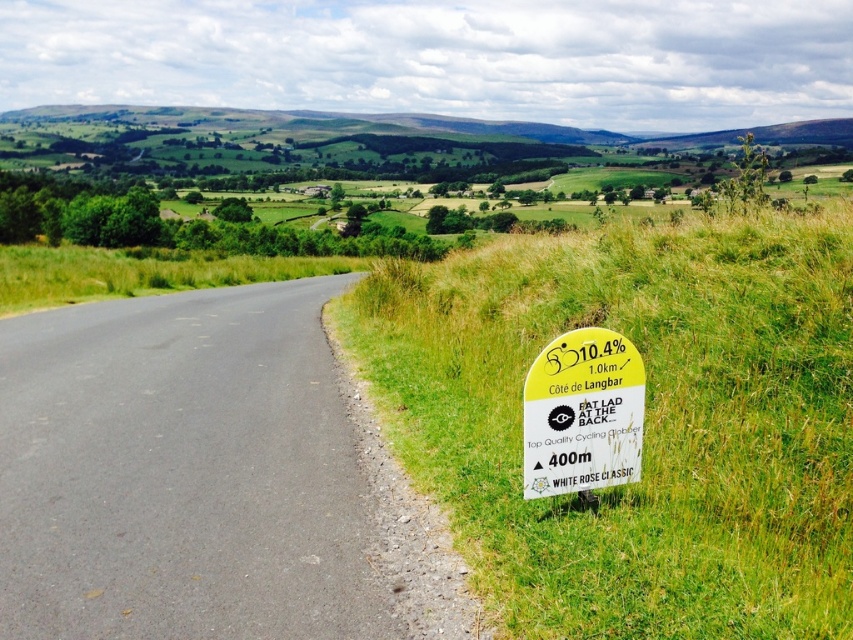
Question: Among these points, which one is farthest from the camera?

Choices:
 (A) (410, 365)
 (B) (573, 355)

Answer: (A)

Question: Which of the following is the farthest from the observer?

Choices:
 (A) (689, 589)
 (B) (599, 380)

Answer: (B)

Question: Is green grassy at right smaller than yellow paper sign at right?

Choices:
 (A) yes
 (B) no

Answer: (B)

Question: Which point is farther to the camera?

Choices:
 (A) (630, 468)
 (B) (810, 529)

Answer: (A)

Question: Is green grassy at right to the left of yellow paper sign at right from the viewer's perspective?

Choices:
 (A) no
 (B) yes

Answer: (A)

Question: Can you confirm if green grassy at right is thinner than yellow paper sign at right?

Choices:
 (A) no
 (B) yes

Answer: (A)